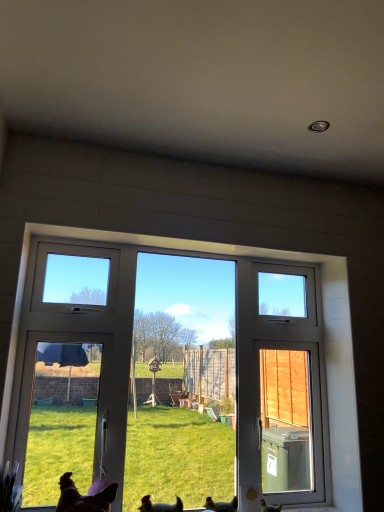
What do you see at coordinates (160, 505) in the screenshot? This screenshot has width=384, height=512. I see `brown fur dog at lower center, the 1th dog positioned from the right` at bounding box center [160, 505].

The width and height of the screenshot is (384, 512). In order to click on white plastic window at center in this screenshot , I will do `click(324, 336)`.

What is the approximate height of brown feathered chicken at lower center, positioned as the 1th chicken in left-to-right order?

brown feathered chicken at lower center, positioned as the 1th chicken in left-to-right order, is 4.19 inches in height.

This screenshot has height=512, width=384. I want to click on brown matte chicken at lower right, the 1th chicken when ordered from right to left, so click(x=269, y=507).

At what (x,y) coordinates should I click in order to perform the action: click on brown fur dog at lower center, which is the second dog from left to right. Please return your answer as a coordinate pair (x, y). Looking at the image, I should click on (160, 505).

Is brown matte chicken at lower right, the second chicken in the left-to-right sequence, looking in the opposite direction of brown feathered chicken at lower center, the 2th chicken from the right?

brown matte chicken at lower right, the second chicken in the left-to-right sequence, does not have its back to brown feathered chicken at lower center, the 2th chicken from the right.

Considering the sizes of objects brown matte chicken at lower right, the 1th chicken when ordered from right to left, and brown feathered chicken at lower center, the 2th chicken from the right, in the image provided, who is taller, brown matte chicken at lower right, the 1th chicken when ordered from right to left, or brown feathered chicken at lower center, the 2th chicken from the right,?

brown feathered chicken at lower center, the 2th chicken from the right.

Is brown matte chicken at lower right, the second chicken in the left-to-right sequence, in contact with brown feathered chicken at lower center, positioned as the 1th chicken in left-to-right order?

brown matte chicken at lower right, the second chicken in the left-to-right sequence, and brown feathered chicken at lower center, positioned as the 1th chicken in left-to-right order, are clearly separated.

Where is `window above the brown matte chicken at lower right, the 1th chicken when ordered from right to left (from the image's perspective)`? The width and height of the screenshot is (384, 512). window above the brown matte chicken at lower right, the 1th chicken when ordered from right to left (from the image's perspective) is located at coordinates (324, 336).

From a real-world perspective, which is physically below, white plastic window at center or brown matte chicken at lower right, the 1th chicken when ordered from right to left?

brown matte chicken at lower right, the 1th chicken when ordered from right to left, from a real-world perspective.

Can you tell me how much white plastic window at center and brown matte chicken at lower right, the 1th chicken when ordered from right to left, differ in facing direction?

They differ by 1.6 degrees in their facing directions.

Considering the positions of points (349, 353) and (273, 509), is point (349, 353) farther from camera compared to point (273, 509)?

That is True.

From a real-world perspective, is white plastic window at center above or below brown fur dog at lower left, the 2th dog positioned from the right?

In terms of real-world spatial position, white plastic window at center is above brown fur dog at lower left, the 2th dog positioned from the right.

Is white plastic window at center smaller than brown fur dog at lower left, which is counted as the first dog, starting from the left?

Actually, white plastic window at center might be larger than brown fur dog at lower left, which is counted as the first dog, starting from the left.

Based on the photo, from the image's perspective, which object appears higher, white plastic window at center or brown fur dog at lower left, which is counted as the first dog, starting from the left?

white plastic window at center.

Does brown feathered chicken at lower center, the 2th chicken from the right, have a lesser height compared to brown matte chicken at lower right, the second chicken in the left-to-right sequence?

No.

Is brown feathered chicken at lower center, positioned as the 1th chicken in left-to-right order, spatially inside brown matte chicken at lower right, the second chicken in the left-to-right sequence, or outside of it?

brown feathered chicken at lower center, positioned as the 1th chicken in left-to-right order, lies outside brown matte chicken at lower right, the second chicken in the left-to-right sequence.

In the scene shown: Is brown feathered chicken at lower center, the 2th chicken from the right, in front of brown matte chicken at lower right, the second chicken in the left-to-right sequence?

Yes, brown feathered chicken at lower center, the 2th chicken from the right, is closer to the viewer.

Could you tell me if brown feathered chicken at lower center, the 2th chicken from the right, is facing brown matte chicken at lower right, the second chicken in the left-to-right sequence?

No, brown feathered chicken at lower center, the 2th chicken from the right, is not facing towards brown matte chicken at lower right, the second chicken in the left-to-right sequence.

From a real-world perspective, is brown matte chicken at lower right, the second chicken in the left-to-right sequence, located beneath brown fur dog at lower left, the 2th dog positioned from the right?

Yes, from a real-world perspective, brown matte chicken at lower right, the second chicken in the left-to-right sequence, is beneath brown fur dog at lower left, the 2th dog positioned from the right.

Considering the relative sizes of brown matte chicken at lower right, the second chicken in the left-to-right sequence, and brown fur dog at lower left, which is counted as the first dog, starting from the left, in the image provided, is brown matte chicken at lower right, the second chicken in the left-to-right sequence, taller than brown fur dog at lower left, which is counted as the first dog, starting from the left,?

No, brown matte chicken at lower right, the second chicken in the left-to-right sequence, is not taller than brown fur dog at lower left, which is counted as the first dog, starting from the left.

Visually, is brown matte chicken at lower right, the 1th chicken when ordered from right to left, positioned to the left or to the right of brown fur dog at lower left, which is counted as the first dog, starting from the left?

From the image, it's evident that brown matte chicken at lower right, the 1th chicken when ordered from right to left, is to the right of brown fur dog at lower left, which is counted as the first dog, starting from the left.

From the image's perspective, is brown matte chicken at lower right, the 1th chicken when ordered from right to left, under brown fur dog at lower left, which is counted as the first dog, starting from the left?

Yes, from the image's perspective, brown matte chicken at lower right, the 1th chicken when ordered from right to left, is below brown fur dog at lower left, which is counted as the first dog, starting from the left.

From a real-world perspective, is brown fur dog at lower center, the 1th dog positioned from the right, located beneath brown fur dog at lower left, the 2th dog positioned from the right?

Indeed, from a real-world perspective, brown fur dog at lower center, the 1th dog positioned from the right, is positioned beneath brown fur dog at lower left, the 2th dog positioned from the right.

Considering the relative sizes of brown fur dog at lower center, the 1th dog positioned from the right, and brown fur dog at lower left, the 2th dog positioned from the right, in the image provided, is brown fur dog at lower center, the 1th dog positioned from the right, thinner than brown fur dog at lower left, the 2th dog positioned from the right,?

Yes, brown fur dog at lower center, the 1th dog positioned from the right, is thinner than brown fur dog at lower left, the 2th dog positioned from the right.

You are a GUI agent. You are given a task and a screenshot of the screen. Output one action in this format:
    pyautogui.click(x=<x>, y=<y>)
    Task: Click on the dog on the left of the brown fur dog at lower center, which is the second dog from left to right
    
    Given the screenshot: What is the action you would take?
    pyautogui.click(x=83, y=497)

From the image's perspective, is brown fur dog at lower center, the 1th dog positioned from the right, located above or below brown fur dog at lower left, the 2th dog positioned from the right?

brown fur dog at lower center, the 1th dog positioned from the right, is below brown fur dog at lower left, the 2th dog positioned from the right.

Which of these two, brown fur dog at lower center, which is the second dog from left to right, or brown matte chicken at lower right, the 1th chicken when ordered from right to left, is wider?

brown fur dog at lower center, which is the second dog from left to right, is wider.

Considering the relative positions of brown fur dog at lower center, the 1th dog positioned from the right, and brown matte chicken at lower right, the 1th chicken when ordered from right to left, in the image provided, is brown fur dog at lower center, the 1th dog positioned from the right, in front of brown matte chicken at lower right, the 1th chicken when ordered from right to left,?

Yes, brown fur dog at lower center, the 1th dog positioned from the right, is in front of brown matte chicken at lower right, the 1th chicken when ordered from right to left.

Who is taller, brown fur dog at lower center, which is the second dog from left to right, or brown matte chicken at lower right, the 1th chicken when ordered from right to left?

Standing taller between the two is brown fur dog at lower center, which is the second dog from left to right.

Where is `chicken below the brown feathered chicken at lower center, positioned as the 1th chicken in left-to-right order (from a real-world perspective)`? chicken below the brown feathered chicken at lower center, positioned as the 1th chicken in left-to-right order (from a real-world perspective) is located at coordinates (269, 507).

Identify the location of window positioned vertically above the brown matte chicken at lower right, the 1th chicken when ordered from right to left (from a real-world perspective). (324, 336).

In the scene shown: From the image, which object appears to be farther from brown feathered chicken at lower center, the 2th chicken from the right, brown fur dog at lower center, which is the second dog from left to right, or brown fur dog at lower left, which is counted as the first dog, starting from the left?

brown fur dog at lower left, which is counted as the first dog, starting from the left, is positioned further to the anchor brown feathered chicken at lower center, the 2th chicken from the right.

Looking at the image, which one is located further to brown matte chicken at lower right, the second chicken in the left-to-right sequence, brown fur dog at lower left, which is counted as the first dog, starting from the left, or brown fur dog at lower center, the 1th dog positioned from the right?

brown fur dog at lower left, which is counted as the first dog, starting from the left, lies further to brown matte chicken at lower right, the second chicken in the left-to-right sequence, than the other object.

Considering their positions, is brown matte chicken at lower right, the second chicken in the left-to-right sequence, positioned closer to brown fur dog at lower left, the 2th dog positioned from the right, than white plastic window at center?

Among the two, brown matte chicken at lower right, the second chicken in the left-to-right sequence, is located nearer to brown fur dog at lower left, the 2th dog positioned from the right.

From the image, which object appears to be nearer to brown fur dog at lower center, which is the second dog from left to right, brown feathered chicken at lower center, the 2th chicken from the right, or white plastic window at center?

Among the two, brown feathered chicken at lower center, the 2th chicken from the right, is located nearer to brown fur dog at lower center, which is the second dog from left to right.

Based on their spatial positions, is brown matte chicken at lower right, the second chicken in the left-to-right sequence, or white plastic window at center further from brown feathered chicken at lower center, positioned as the 1th chicken in left-to-right order?

white plastic window at center.

Looking at the image, which one is located closer to brown matte chicken at lower right, the 1th chicken when ordered from right to left, brown fur dog at lower left, the 2th dog positioned from the right, or white plastic window at center?

Based on the image, brown fur dog at lower left, the 2th dog positioned from the right, appears to be nearer to brown matte chicken at lower right, the 1th chicken when ordered from right to left.

When comparing their distances from brown matte chicken at lower right, the 1th chicken when ordered from right to left, does white plastic window at center or brown fur dog at lower left, the 2th dog positioned from the right, seem closer?

Among the two, brown fur dog at lower left, the 2th dog positioned from the right, is located nearer to brown matte chicken at lower right, the 1th chicken when ordered from right to left.

Which object lies nearer to the anchor point brown feathered chicken at lower center, the 2th chicken from the right, brown fur dog at lower center, which is the second dog from left to right, or brown matte chicken at lower right, the second chicken in the left-to-right sequence?

brown matte chicken at lower right, the second chicken in the left-to-right sequence, lies closer to brown feathered chicken at lower center, the 2th chicken from the right, than the other object.

Where is `chicken between white plastic window at center and brown matte chicken at lower right, the 1th chicken when ordered from right to left, in the vertical direction`? Image resolution: width=384 pixels, height=512 pixels. chicken between white plastic window at center and brown matte chicken at lower right, the 1th chicken when ordered from right to left, in the vertical direction is located at coordinates (222, 505).

The height and width of the screenshot is (512, 384). I want to click on dog between white plastic window at center and brown fur dog at lower center, which is the second dog from left to right, from top to bottom, so click(83, 497).

I want to click on window between brown fur dog at lower left, the 2th dog positioned from the right, and brown matte chicken at lower right, the 1th chicken when ordered from right to left, in the horizontal direction, so click(x=324, y=336).

You are a GUI agent. You are given a task and a screenshot of the screen. Output one action in this format:
    pyautogui.click(x=<x>, y=<y>)
    Task: Click on the chicken between brown fur dog at lower center, which is the second dog from left to right, and brown matte chicken at lower right, the 1th chicken when ordered from right to left, in the horizontal direction
    
    Given the screenshot: What is the action you would take?
    pyautogui.click(x=222, y=505)